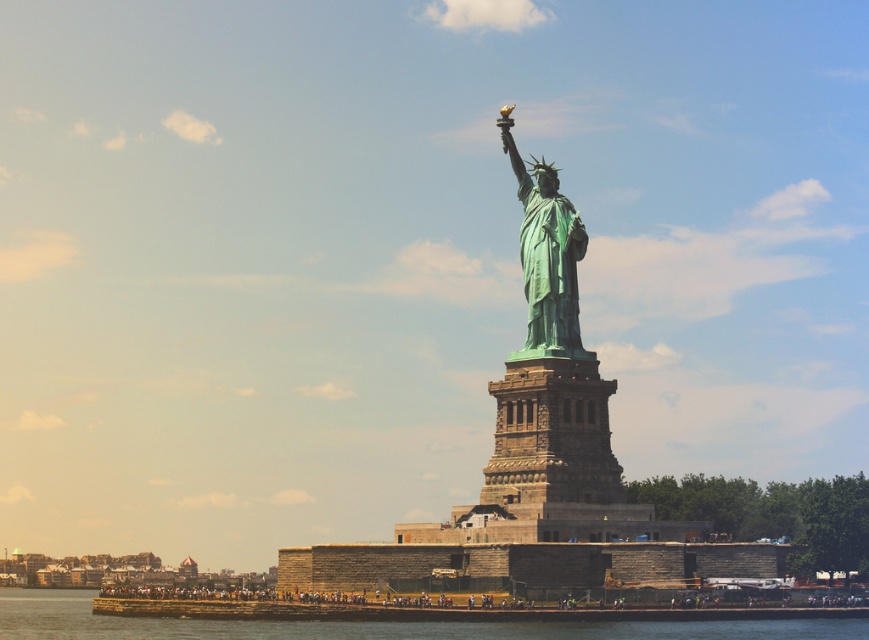
You are standing at the base of the Statue of Liberty and notice a specific point marked at coordinates (375, 625). According to the image, what does this point indicate?

The point at coordinates (375, 625) marks the green patina water at lower center.

You are standing on the observation deck of the Statue of Liberty and looking down. You see the green patina water at lower center and the green patina statue at center. Which object is positioned to the left when viewed from your perspective?

The green patina water at lower center is to the left of the green patina statue at center from your perspective.

You are a tour guide standing at the base of the Statue of Liberty. You want to show visitors the green patina water at lower center and the green patina statue at center. How far apart are these two landmarks?

The distance between the green patina water at lower center and the green patina statue at center is 30.63 meters.